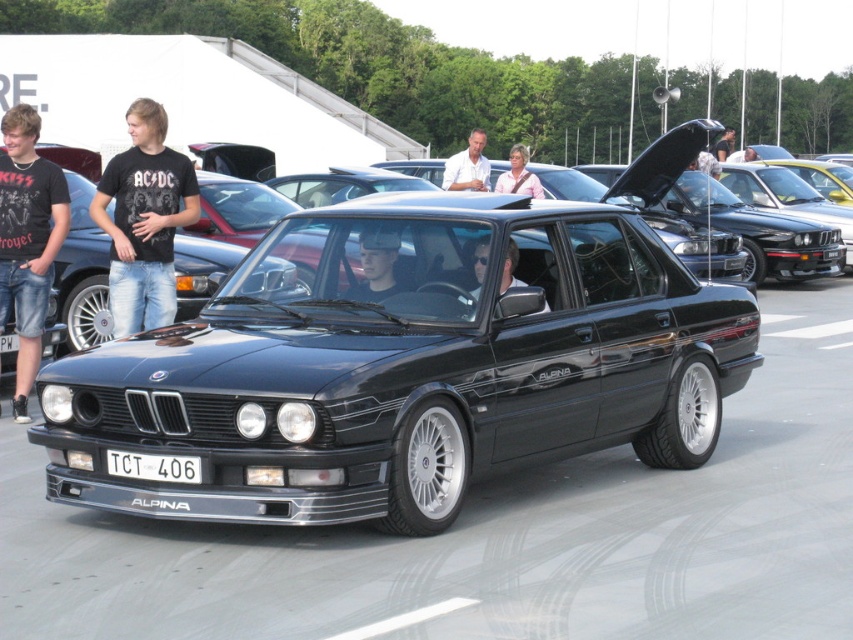
You are standing at the point where the viewer is located in the image. There is a point marked at coordinates (151,168). If you want to place a 1.5 meter long banner between you and that point, will there be enough space?

The distance between the viewer and the point (151,168) is 8.22 meters. Since the banner is only 1.5 meters long, there is sufficient space to place it between you and the point.